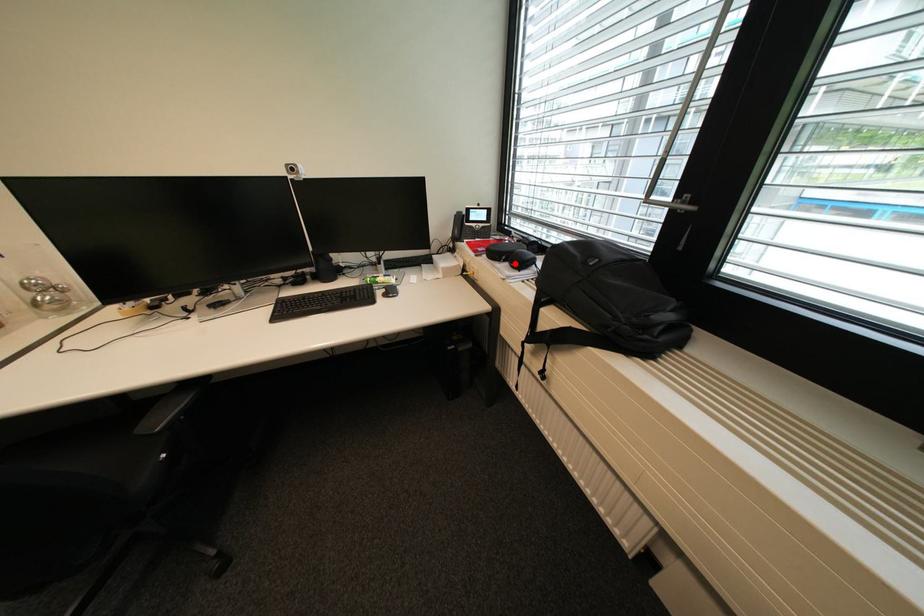
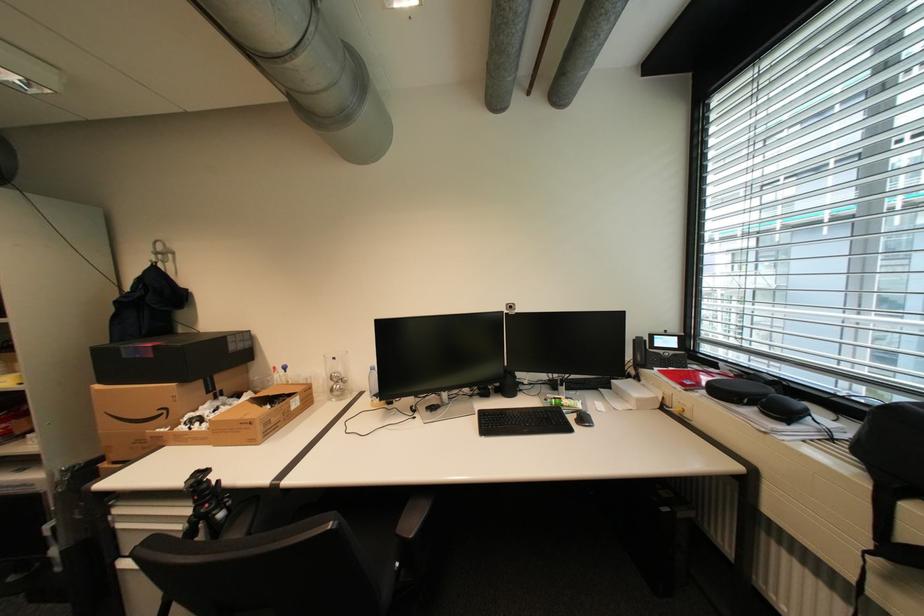
Question: I am providing you with two images of the same scene from different viewpoints. A red point is marked on the first image. Is the red point's position out of view in image 2?

Choices:
 (A) Yes
 (B) No

Answer: (B)